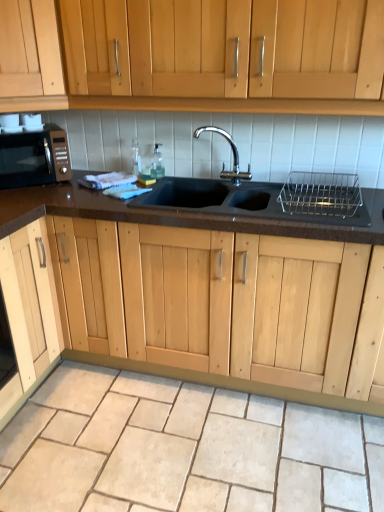
Image resolution: width=384 pixels, height=512 pixels. What do you see at coordinates (135, 158) in the screenshot?
I see `clear glass bottle at sink, which is the second bottle in right-to-left order` at bounding box center [135, 158].

Where is `light wood cabinet at upper left`? The width and height of the screenshot is (384, 512). light wood cabinet at upper left is located at coordinates click(30, 57).

Where is `metallic silver dish rack at upper right`? metallic silver dish rack at upper right is located at coordinates (321, 194).

Identify the location of clear glass bottle at sink, which is the 2th bottle from left to right. (157, 163).

Where is `clear glass bottle at sink, which is the 1th bottle from left to right`? The height and width of the screenshot is (512, 384). clear glass bottle at sink, which is the 1th bottle from left to right is located at coordinates (135, 158).

Is metallic silver dish rack at upper right bigger than clear glass bottle at sink, which is counted as the 1th bottle, starting from the right?

Yes.

Would you say metallic silver dish rack at upper right is inside or outside clear glass bottle at sink, which is the 2th bottle from left to right?

metallic silver dish rack at upper right is not inside clear glass bottle at sink, which is the 2th bottle from left to right, it's outside.

Is metallic silver dish rack at upper right next to clear glass bottle at sink, which is counted as the 1th bottle, starting from the right?

They are not placed beside each other.

Does point (316, 178) appear closer or farther from the camera than point (151, 162)?

Point (316, 178) appears to be closer to the viewer than point (151, 162).

Would you say beige stone granite at lower center is a long distance from matte black microwave at left?

Yes, beige stone granite at lower center is far from matte black microwave at left.

Is beige stone granite at lower center further to the viewer compared to matte black microwave at left?

That is False.

Considering the sizes of objects beige stone granite at lower center and matte black microwave at left in the image provided, who is taller, beige stone granite at lower center or matte black microwave at left?

matte black microwave at left is taller.

Is beige stone granite at lower center aimed at matte black microwave at left?

No.

Looking at this image, from a real-world perspective, is black granite sink at center physically above matte black microwave at left?

No, from a real-world perspective, black granite sink at center is not on top of matte black microwave at left.

Is black granite sink at center not within matte black microwave at left?

Yes, black granite sink at center is not within matte black microwave at left.

Does black granite sink at center turn towards matte black microwave at left?

No, black granite sink at center is not oriented towards matte black microwave at left.

Between point (155, 196) and point (30, 143), which one is positioned behind?

The point (155, 196) is more distant.

In the scene shown: Considering the sizes of objects black granite sink at center and metallic silver dish rack at upper right in the image provided, who is wider, black granite sink at center or metallic silver dish rack at upper right?

black granite sink at center.

From the image's perspective, which is above, black granite sink at center or metallic silver dish rack at upper right?

From the image's view, black granite sink at center is above.

Is black granite sink at center to the right of metallic silver dish rack at upper right from the viewer's perspective?

In fact, black granite sink at center is to the left of metallic silver dish rack at upper right.

Measure the distance from black granite sink at center to metallic silver dish rack at upper right.

black granite sink at center is 4.95 inches from metallic silver dish rack at upper right.

From a real-world perspective, is metallic silver dish rack at upper right positioned under matte black microwave at left based on gravity?

Yes, from a real-world perspective, metallic silver dish rack at upper right is below matte black microwave at left.

Between metallic silver dish rack at upper right and matte black microwave at left, which one is positioned behind?

Positioned behind is matte black microwave at left.

Can matte black microwave at left be found inside metallic silver dish rack at upper right?

No, matte black microwave at left is located outside of metallic silver dish rack at upper right.

Can you tell me how much metallic silver dish rack at upper right and matte black microwave at left differ in facing direction?

metallic silver dish rack at upper right and matte black microwave at left are facing 40.3 degrees away from each other.

Identify the location of granite lying below the metallic silver dish rack at upper right (from the image's perspective). This screenshot has width=384, height=512. (183, 449).

Would you say metallic silver dish rack at upper right is a long distance from beige stone granite at lower center?

Absolutely, metallic silver dish rack at upper right is distant from beige stone granite at lower center.

From a real-world perspective, is clear glass bottle at sink, which is counted as the 1th bottle, starting from the right, on matte black microwave at left?

No.

Between clear glass bottle at sink, which is the 2th bottle from left to right, and matte black microwave at left, which one has larger width?

matte black microwave at left.

In the scene shown: Is matte black microwave at left located within clear glass bottle at sink, which is the 2th bottle from left to right?

Definitely not — matte black microwave at left is not inside clear glass bottle at sink, which is the 2th bottle from left to right.

The image size is (384, 512). I want to click on bottle that is the 2nd object to the right of the matte black microwave at left, starting at the anchor, so click(157, 163).

Starting from the metallic silver dish rack at upper right, which bottle is the 2nd one behind? Please provide its 2D coordinates.

[(157, 163)]

This screenshot has height=512, width=384. I want to click on microwave oven lying above the beige stone granite at lower center (from the image's perspective), so click(34, 157).

Considering their positions, is light wood cabinet at upper left positioned further to metallic silver dish rack at upper right than black granite sink at center?

Among the two, light wood cabinet at upper left is located further to metallic silver dish rack at upper right.

Looking at the image, which one is located closer to light wood cabinet at upper left, black granite sink at center or matte black microwave at left?

matte black microwave at left is closer to light wood cabinet at upper left.

When comparing their distances from black granite sink at center, does beige stone granite at lower center or light wood cabinet at upper left seem further?

The object further to black granite sink at center is beige stone granite at lower center.

From the picture: Considering their positions, is clear glass bottle at sink, which is counted as the 1th bottle, starting from the right, positioned further to black granite sink at center than clear glass bottle at sink, which is the 1th bottle from left to right?

Based on the image, clear glass bottle at sink, which is the 1th bottle from left to right, appears to be further to black granite sink at center.

Which object lies further to the anchor point black granite sink at center, beige stone granite at lower center or metallic silver dish rack at upper right?

Among the two, beige stone granite at lower center is located further to black granite sink at center.

When comparing their distances from beige stone granite at lower center, does black granite sink at center or clear glass bottle at sink, which is the second bottle in right-to-left order, seem further?

Among the two, clear glass bottle at sink, which is the second bottle in right-to-left order, is located further to beige stone granite at lower center.

Considering their positions, is black granite sink at center positioned further to metallic silver dish rack at upper right than light wood cabinet at upper left?

light wood cabinet at upper left is positioned further to the anchor metallic silver dish rack at upper right.

From the image, which object appears to be nearer to black granite sink at center, metallic silver dish rack at upper right or clear glass bottle at sink, which is the second bottle in right-to-left order?

Among the two, metallic silver dish rack at upper right is located nearer to black granite sink at center.

Locate an element on the screen. bottle between black granite sink at center and clear glass bottle at sink, which is counted as the 1th bottle, starting from the right, in the front-back direction is located at coordinates (135, 158).

The width and height of the screenshot is (384, 512). I want to click on sink that lies between light wood cabinet at upper left and beige stone granite at lower center from top to bottom, so click(x=264, y=194).

I want to click on cabinetry located between matte black microwave at left and clear glass bottle at sink, which is the 2th bottle from left to right, in the left-right direction, so click(x=30, y=57).

Locate an element on the screen. sink located between light wood cabinet at upper left and metallic silver dish rack at upper right in the left-right direction is located at coordinates tap(264, 194).